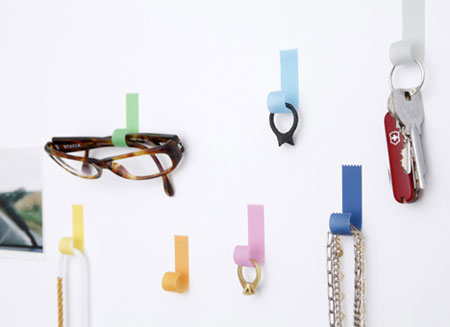
I want to click on plastic hooks, so click(75, 232), click(130, 123), click(183, 261), click(256, 221), click(289, 88), click(357, 190), click(413, 18).